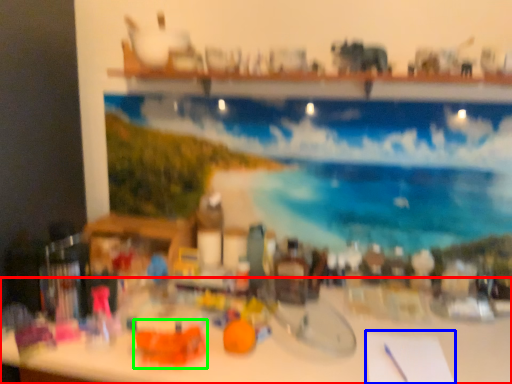
Question: Which is farther away from table (highlighted by a red box)? notepad (highlighted by a blue box) or toy (highlighted by a green box)?

Choices:
 (A) notepad
 (B) toy

Answer: (B)